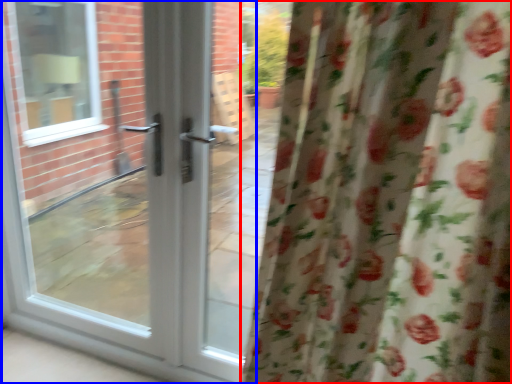
Question: Which object is closer to the camera taking this photo, curtain (highlighted by a red box) or door (highlighted by a blue box)?

Choices:
 (A) curtain
 (B) door

Answer: (A)